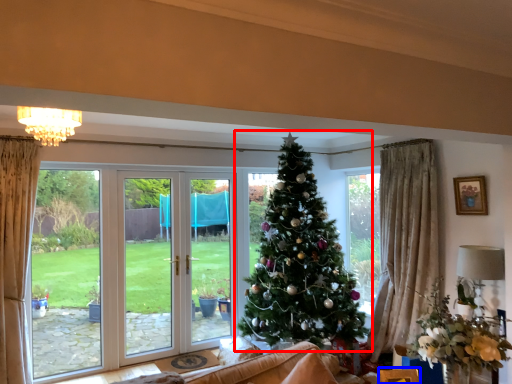
Question: Among these objects, which one is farthest to the camera, christmas tree (highlighted by a red box) or furniture (highlighted by a blue box)?

Choices:
 (A) christmas tree
 (B) furniture

Answer: (A)